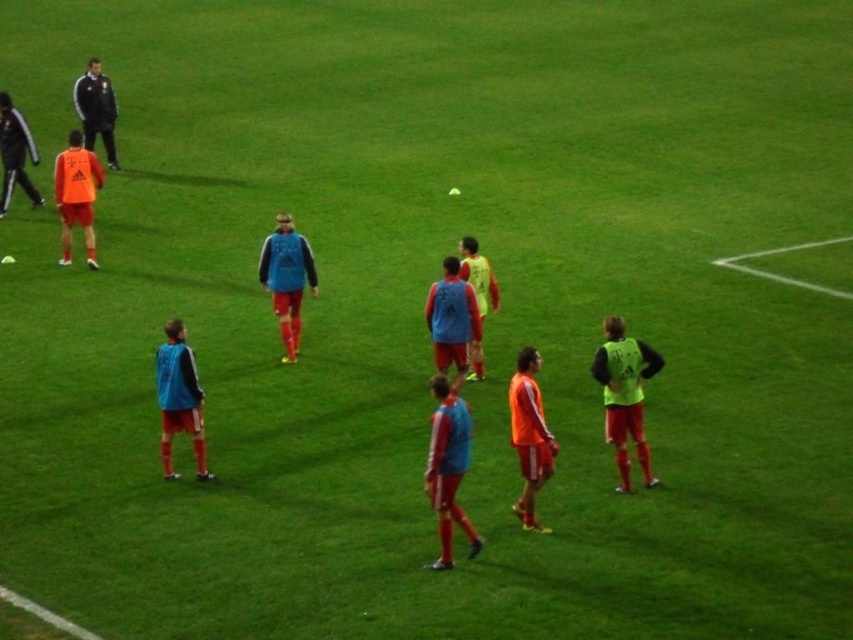
You are standing on the soccer field and want to move from point A to point B. Point A is at coordinate point (x=314, y=292) and point B is at coordinate point (x=70, y=204). Which point is closer to you when you start at point A?

Point A at coordinate point (x=314, y=292) is closer to you when you start at point A because you are already at that point.

You are a photographer positioned at the edge of the soccer field. You want to take a photo of the orange jersey at left and the matte black jacket at left. Which object will appear larger in your photo?

The orange jersey at left will appear larger in the photo because it is closer to the viewer than the matte black jacket at left.

You are a photographer positioned at the back of the field. You need to capture a photo that includes both the blue fleece jacket at center and the orange jersey at left. Based on their positions, which one will appear lower in the photo?

The blue fleece jacket at center is located below the orange jersey at left, so in the photo, the blue fleece jacket at center will appear lower than the orange jersey at left.